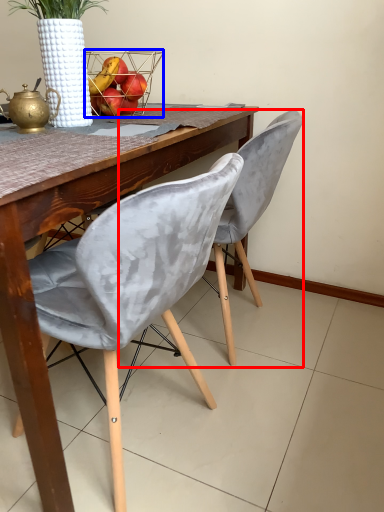
Question: Which object is further to the camera taking this photo, chair (highlighted by a red box) or basket (highlighted by a blue box)?

Choices:
 (A) chair
 (B) basket

Answer: (B)